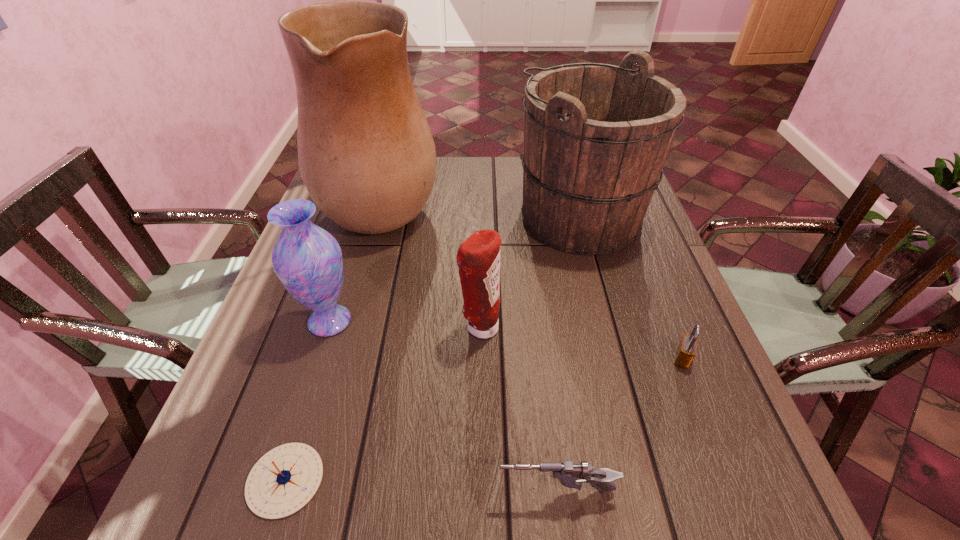
This screenshot has height=540, width=960. I want to click on free space at the right edge, so click(676, 342).

In order to click on vacant area that lies between the gun and the compass in this screenshot , I will do `click(420, 485)`.

Image resolution: width=960 pixels, height=540 pixels. I want to click on vacant region between the fourth shortest object and the bucket, so click(x=530, y=273).

At what (x,y) coordinates should I click in order to perform the action: click on free space between the cream pitcher and the fourth tallest object. Please return your answer as a coordinate pair (x, y). Looking at the image, I should click on (431, 264).

Find the location of a particular element. free spot between the tallest object and the fifth farthest object is located at coordinates click(x=533, y=280).

At what (x,y) coordinates should I click in order to perform the action: click on vacant space that's between the bucket and the fifth farthest object. Please return your answer as a coordinate pair (x, y). This screenshot has width=960, height=540. Looking at the image, I should click on click(x=632, y=288).

Locate an element on the screen. This screenshot has width=960, height=540. free space between the shortest object and the fifth shortest object is located at coordinates (307, 401).

Image resolution: width=960 pixels, height=540 pixels. I want to click on empty space that is in between the bucket and the cream pitcher, so click(482, 210).

Identify the location of vacant area between the shortest object and the cream pitcher. The height and width of the screenshot is (540, 960). (334, 340).

You are a GUI agent. You are given a task and a screenshot of the screen. Output one action in this format:
    pyautogui.click(x=<x>, y=<y>)
    Task: Click on the free space that is in between the third nearest object and the compass
    
    Given the screenshot: What is the action you would take?
    pyautogui.click(x=484, y=419)